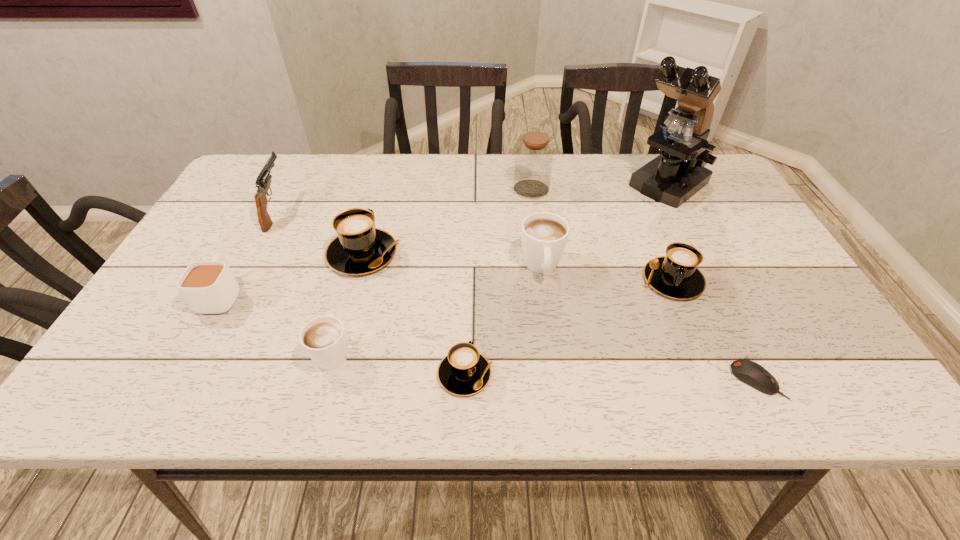
This screenshot has height=540, width=960. Identify the location of cappuccino that is the fourth closest to the biggest black cappuccino. (676, 275).

Select which black cappuccino is the closest to the smallest black cappuccino. Please provide its 2D coordinates. Your answer should be formatted as a tuple, i.e. [(x, y)], where the tuple contains the x and y coordinates of a point satisfying the conditions above.

[(360, 248)]

Select which black cappuccino appears as the third closest to the brown jar. Please provide its 2D coordinates. Your answer should be formatted as a tuple, i.e. [(x, y)], where the tuple contains the x and y coordinates of a point satisfying the conditions above.

[(464, 371)]

Where is `vacant area in the image that satisfies the following two spatial constraints: 1. on the back side of the tallest object; 2. on the right side of the leftmost black cappuccino`? vacant area in the image that satisfies the following two spatial constraints: 1. on the back side of the tallest object; 2. on the right side of the leftmost black cappuccino is located at coordinates (381, 186).

Find the location of a particular element. vacant space that satisfies the following two spatial constraints: 1. with the handle on the side of the biggest black cappuccino; 2. on the right side of the nearer white cappuccino is located at coordinates (361, 254).

Image resolution: width=960 pixels, height=540 pixels. Identify the location of free location that satisfies the following two spatial constraints: 1. on the side with the handle of the jar; 2. on the left side of the white cup. (279, 190).